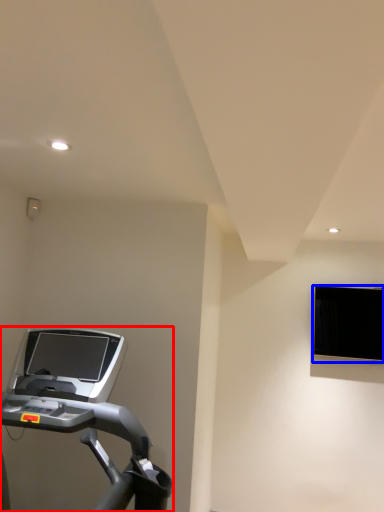
Question: Which of the following is the farthest to the observer, treadmill (highlighted by a red box) or computer monitor (highlighted by a blue box)?

Choices:
 (A) treadmill
 (B) computer monitor

Answer: (B)